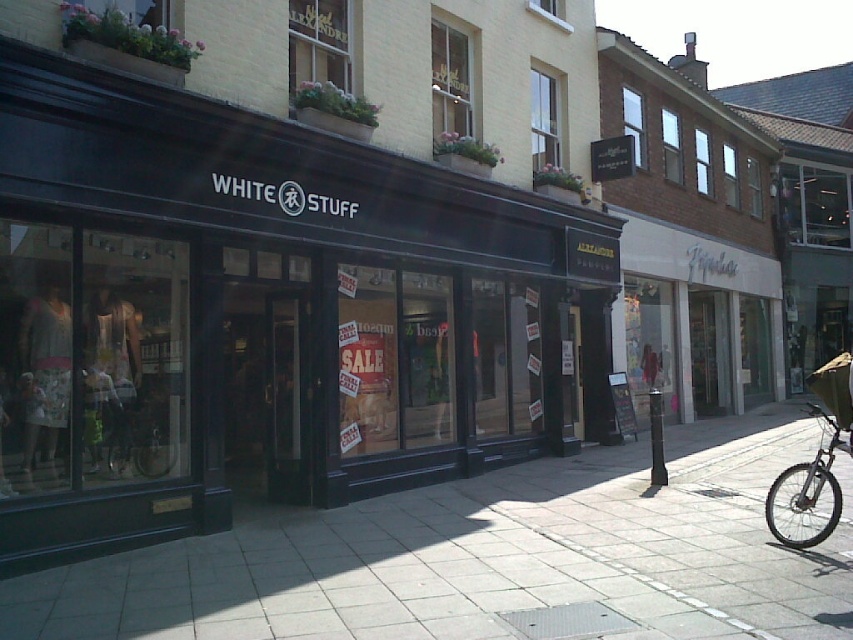
Can you confirm if black matte storefront at center is wider than smooth concrete pavement at center?

In fact, black matte storefront at center might be narrower than smooth concrete pavement at center.

Can you confirm if black matte storefront at center is positioned below smooth concrete pavement at center?

Actually, black matte storefront at center is above smooth concrete pavement at center.

At what (x,y) coordinates should I click in order to perform the action: click on black matte storefront at center. Please return your answer as a coordinate pair (x, y). The width and height of the screenshot is (853, 640). Looking at the image, I should click on (268, 308).

Which is in front, point (374, 572) or point (825, 448)?

Point (374, 572) is more forward.

Based on the photo, is smooth concrete pavement at center further to camera compared to silver metallic bicycle at lower right?

That is False.

Which is in front, point (30, 605) or point (833, 497)?

Positioned in front is point (30, 605).

Find the location of a particular element. smooth concrete pavement at center is located at coordinates (490, 557).

Which is in front, point (769, 472) or point (165, 372)?

Point (165, 372) is in front.

Does smooth concrete pavement at center appear on the left side of green fabric bicycle at center?

In fact, smooth concrete pavement at center is to the right of green fabric bicycle at center.

Is point (814, 618) positioned behind point (131, 358)?

No, (814, 618) is closer to viewer.

Where is `smooth concrete pavement at center`? The image size is (853, 640). smooth concrete pavement at center is located at coordinates (490, 557).